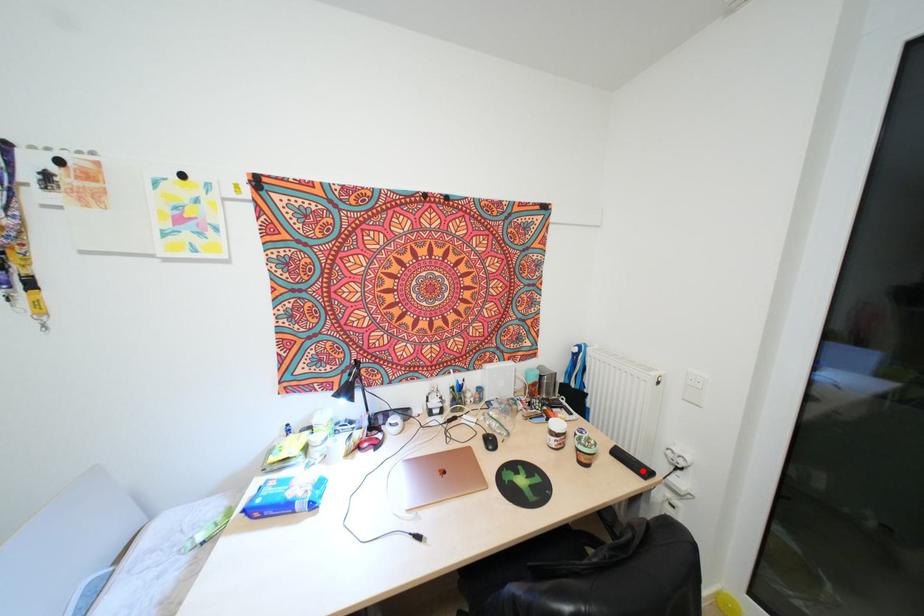
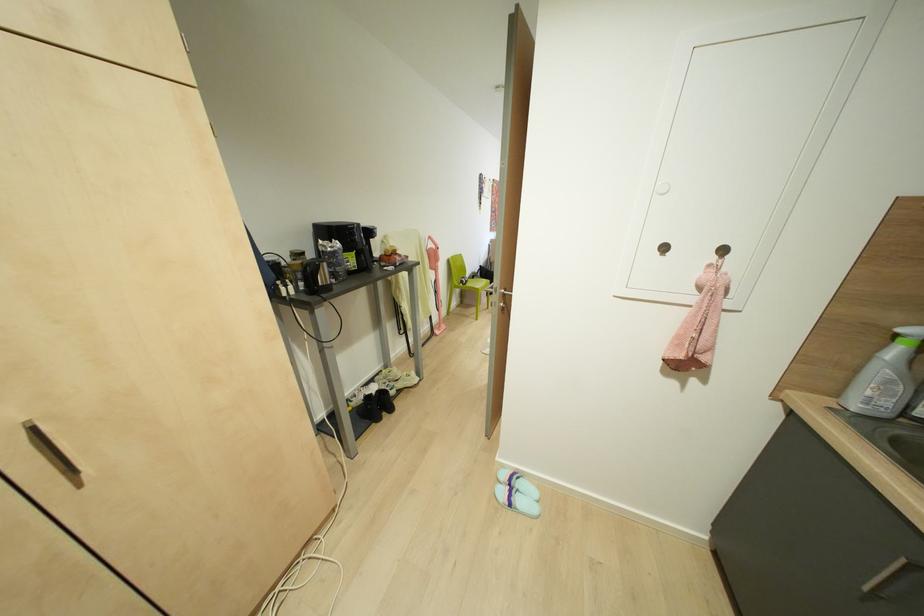
Question: I am providing you with two images of the same scene from different viewpoints. A red point is marked on the first image. Is the red point's position out of view in image 2?

Choices:
 (A) Yes
 (B) No

Answer: (A)